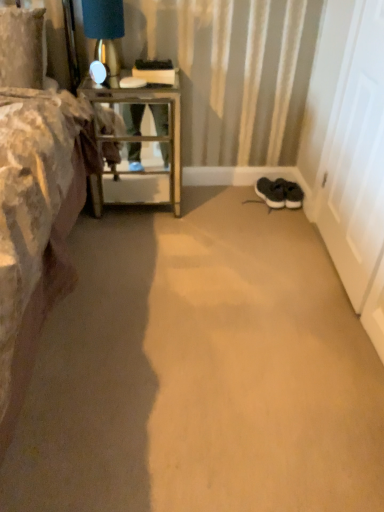
Locate an element on the screen. Image resolution: width=384 pixels, height=512 pixels. vacant space to the left of white matte door at right is located at coordinates (258, 248).